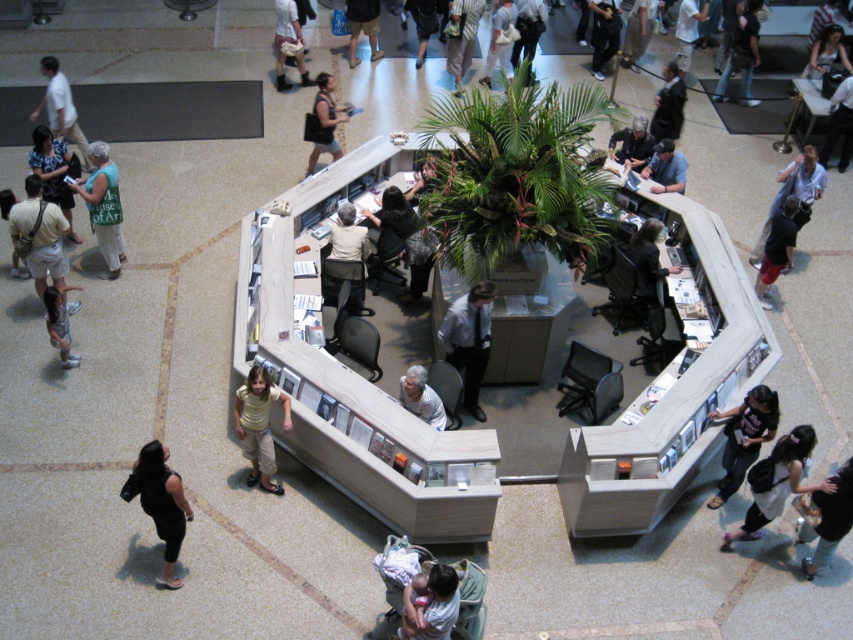
Between matte black shirt at upper center and dark gray suit at center, which one appears on the left side from the viewer's perspective?

From the viewer's perspective, matte black shirt at upper center appears more on the left side.

Between point (347, 118) and point (846, 132), which one is positioned behind?

Positioned behind is point (846, 132).

Is point (344, 122) closer to viewer compared to point (850, 147)?

That is True.

What are the coordinates of `matte black shirt at upper center` in the screenshot? It's located at (325, 120).

Describe the element at coordinates (839, 124) in the screenshot. This screenshot has height=640, width=853. I see `dark gray suit at center` at that location.

Which of these two, dark gray suit at center or dark gray hoodie at upper right, stands taller?

dark gray hoodie at upper right is taller.

Between point (830, 134) and point (608, 35), which one is positioned behind?

The point (608, 35) is more distant.

Where is `dark gray suit at center`? The height and width of the screenshot is (640, 853). dark gray suit at center is located at coordinates (839, 124).

Is point (630, 259) closer to camera compared to point (65, 285)?

Yes, point (630, 259) is in front of point (65, 285).

Image resolution: width=853 pixels, height=640 pixels. I want to click on dark brown leather jacket at center, so click(647, 259).

Is point (648, 269) in front of point (45, 301)?

No, (648, 269) is further to viewer.

Identify the location of dark brown leather jacket at center. (647, 259).